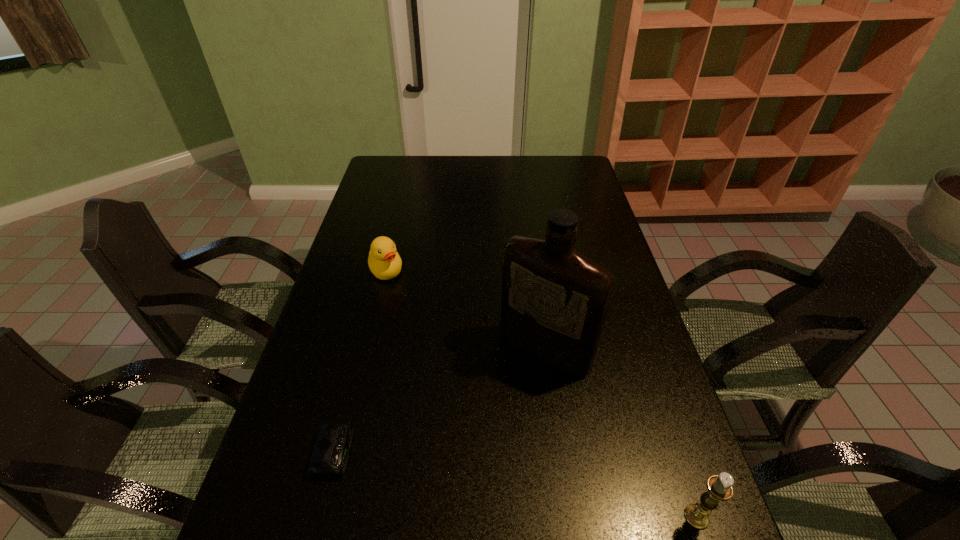
Image resolution: width=960 pixels, height=540 pixels. Identify the location of vacant space on the desktop that is between the alarm clock and the nearest object and is positioned at the beak of the duck. (460, 474).

The height and width of the screenshot is (540, 960). I want to click on vacant spot on the desktop that is between the second nearest object and the candle holder and is positioned on the label side of the tallest object, so click(x=453, y=473).